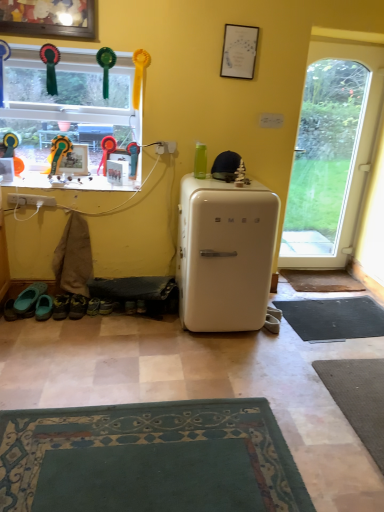
Identify the location of vacant space in front of wooden photo frame at upper left, acting as the 2th picture frame starting from the right. tap(63, 180).